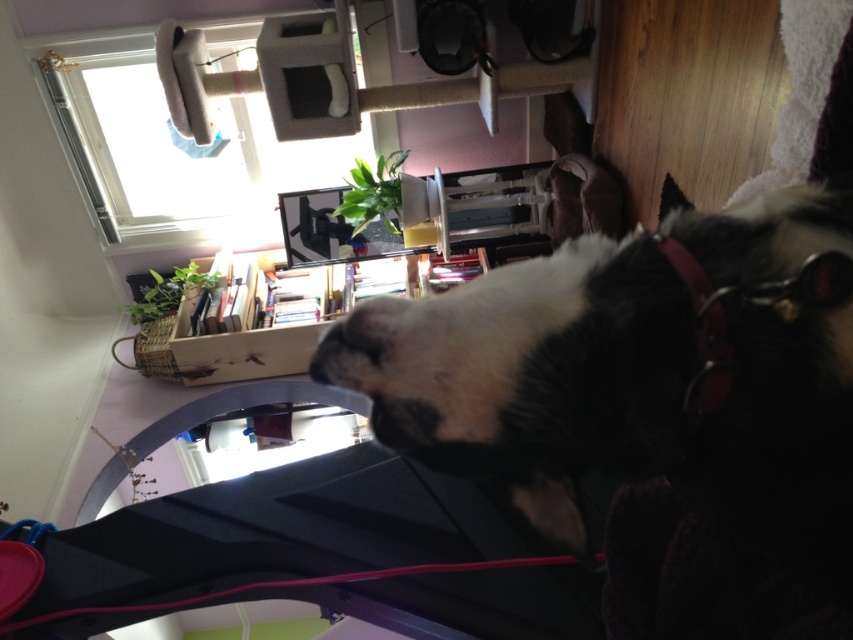
You are standing in the room and see two points marked on the wall. The first point is at coordinate point(717,349) and the second is at point(398,316). Which point is closer to you?

Point(717,349) is in front of point(398,316), so the first point is closer to you.